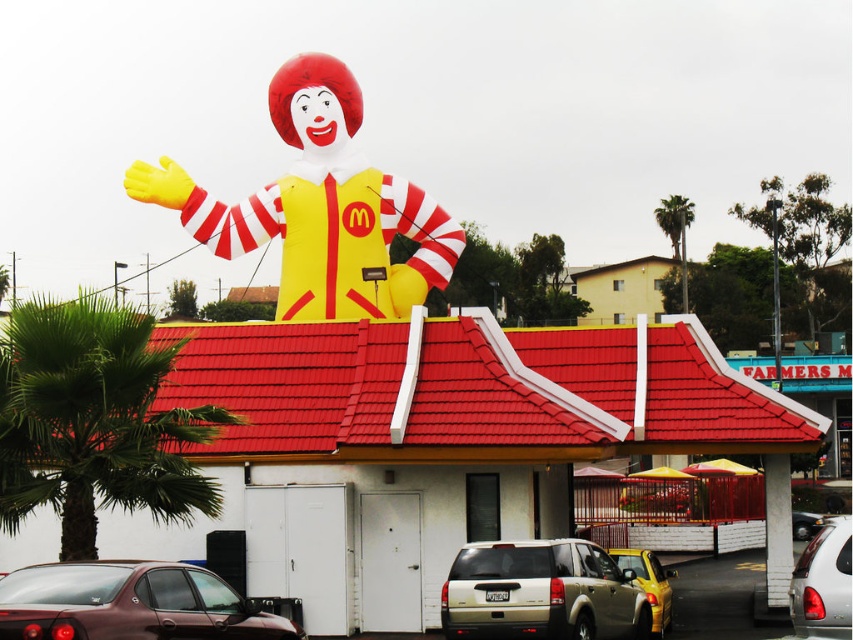
Is point (15, 452) farther from camera compared to point (688, 202)?

That is False.

Can you confirm if green leafy palm tree at left is positioned below green leafy palm tree at upper right?

Yes, green leafy palm tree at left is below green leafy palm tree at upper right.

What are the coordinates of `green leafy palm tree at left` in the screenshot? It's located at (94, 420).

I want to click on green leafy palm tree at left, so click(x=94, y=420).

Measure the distance between point (805, 595) and camera.

Point (805, 595) is 34.88 meters away from camera.

Between point (843, 570) and point (689, 220), which one is positioned behind?

Point (689, 220)

The width and height of the screenshot is (853, 640). Describe the element at coordinates (822, 582) in the screenshot. I see `silver metallic car at lower right` at that location.

This screenshot has width=853, height=640. In order to click on silver metallic car at lower right in this screenshot , I will do `click(822, 582)`.

Between point (639, 611) and point (688, 225), which one is positioned in front?

Point (639, 611) is more forward.

Does gold metallic suv at lower center appear on the left side of green leafy palm tree at upper right?

Yes, gold metallic suv at lower center is to the left of green leafy palm tree at upper right.

Locate an element on the screen. gold metallic suv at lower center is located at coordinates tap(541, 593).